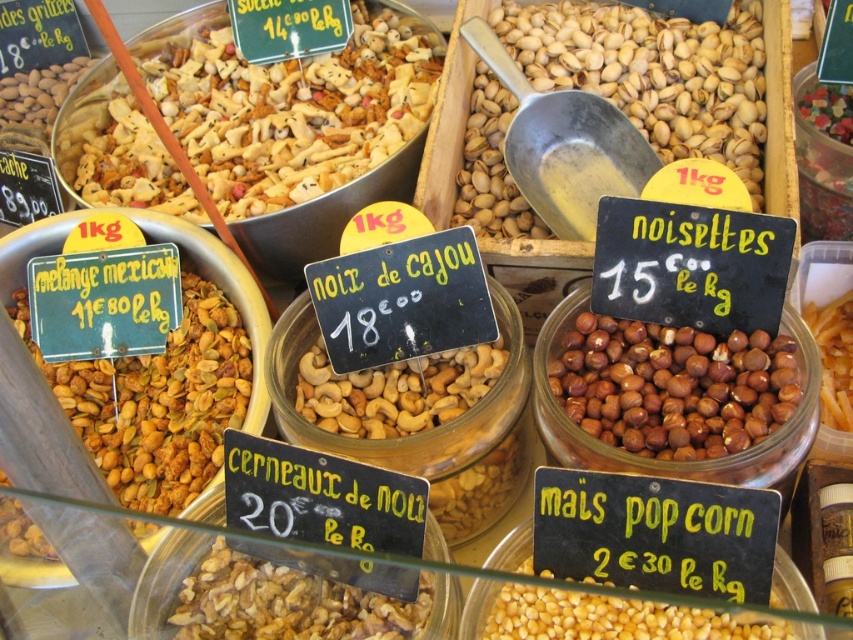
You are standing in front of the market stall and want to buy the brown matte mix at left. Where exactly should you look to find this item?

The brown matte mix at left is located at the coordinates point (157,401).

You are trying to determine which nuts are wider between the shiny metallic nuts at upper left and the pistachio nuts at center. Based on the spatial information provided, can you conclude which one is wider?

The shiny metallic nuts at upper left might be wider than pistachio nuts at center according to the description.